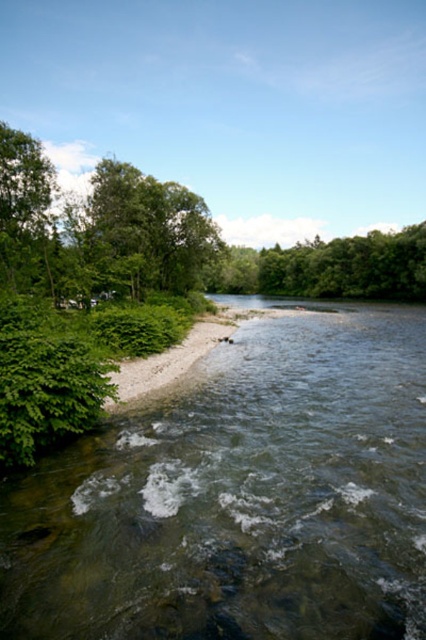
You are planning to cross the river and notice the clear water at river center and the green leafy trees at center. Which area would you avoid stepping on if you want to ensure stable footing?

You should avoid stepping on the clear water at river center because it occupies less space than the green leafy trees at center, implying it might be shallower or have a stronger current, making it less stable.

You are a hiker who wants to cross the river using the clear water at river center. There is a green leafy tree at upper left nearby. Which direction should you head relative to the tree to find the clear water?

You should head to the right of the green leafy tree at upper left to find the clear water at river center.